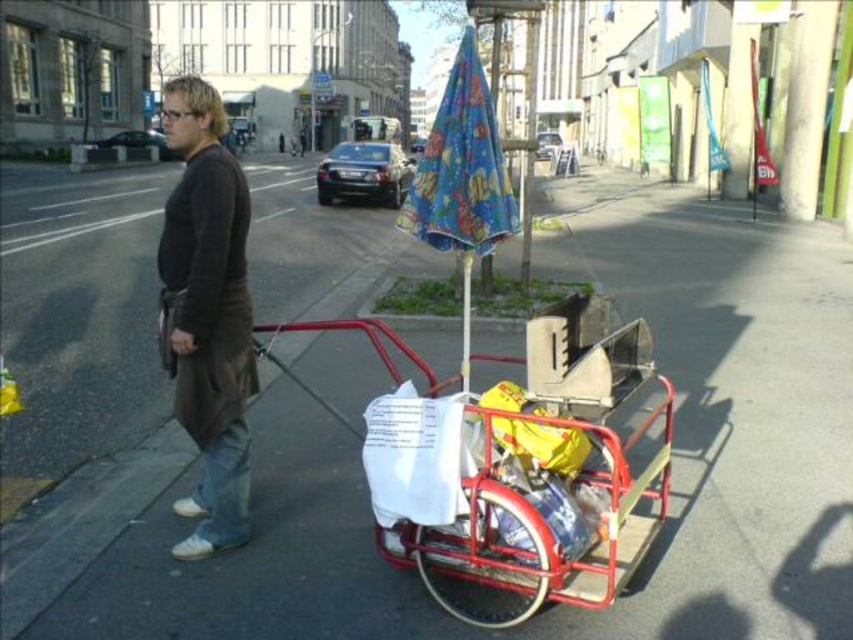
You are standing at the center of the image. Which direction should you move to reach the metallic red trolley at center?

The metallic red trolley at center is already at the center of the image, so you donot need to move in any direction to reach it.

You are standing 10 feet away from the camera. Can you reach the metallic red trolley at center without moving closer?

The metallic red trolley at center is 9.06 feet away from the camera. Since you are standing 10 feet away from the camera, you are farther than the trolley, so you cannot reach it without moving closer.